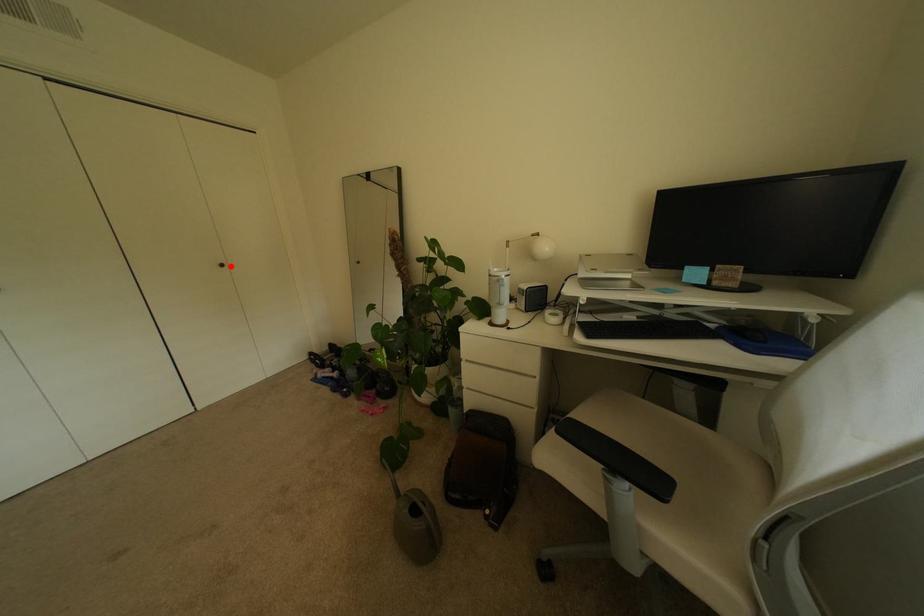
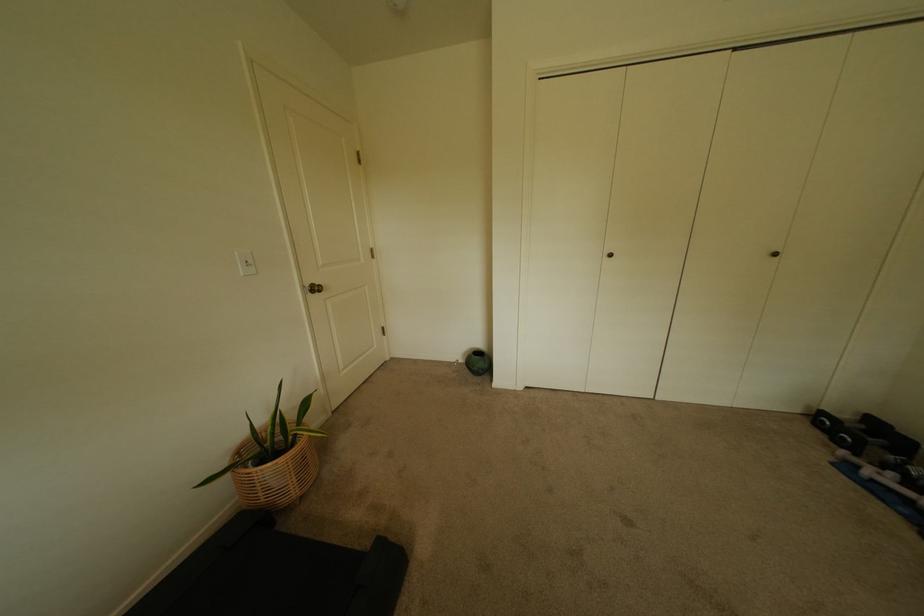
In the second image, find the point that corresponds to the highlighted location in the first image.

(784, 256)